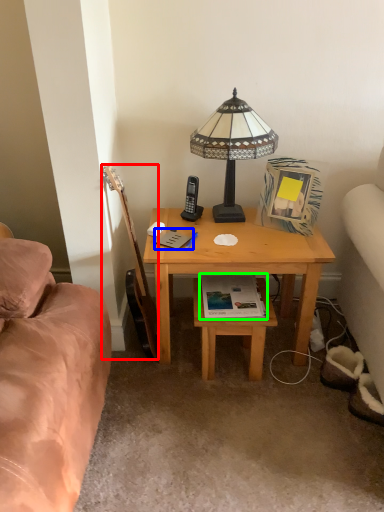
Question: Based on their relative distances, which object is farther from guitar (highlighted by a red box)? Choose from book (highlighted by a blue box) and book (highlighted by a green box).

Choices:
 (A) book
 (B) book

Answer: (B)